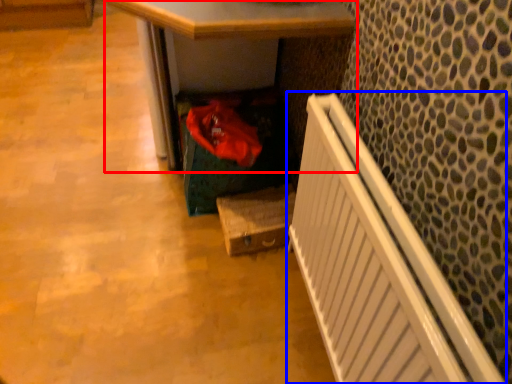
Question: Among these objects, which one is nearest to the camera, desk (highlighted by a red box) or radiator (highlighted by a blue box)?

Choices:
 (A) desk
 (B) radiator

Answer: (B)